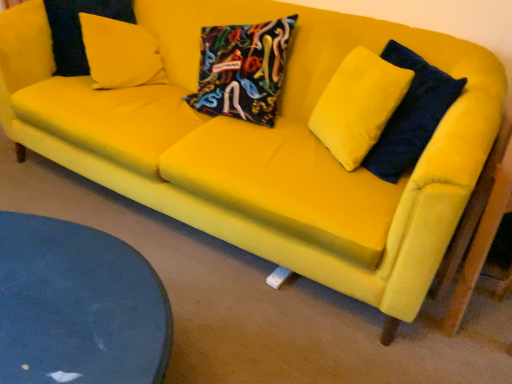
Identify the location of vacant area that is in front of wooden side table at right. (467, 360).